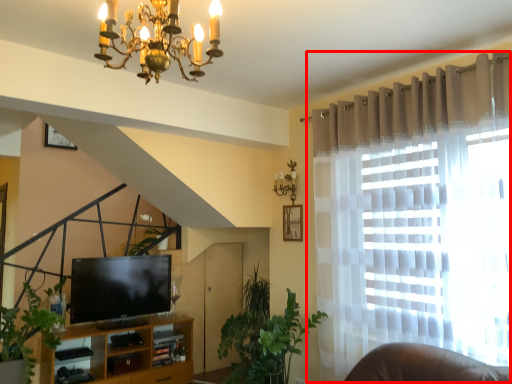
Question: From the image's perspective, where is curtain (annotated by the red box) located in relation to plant in the image?

Choices:
 (A) below
 (B) above

Answer: (B)